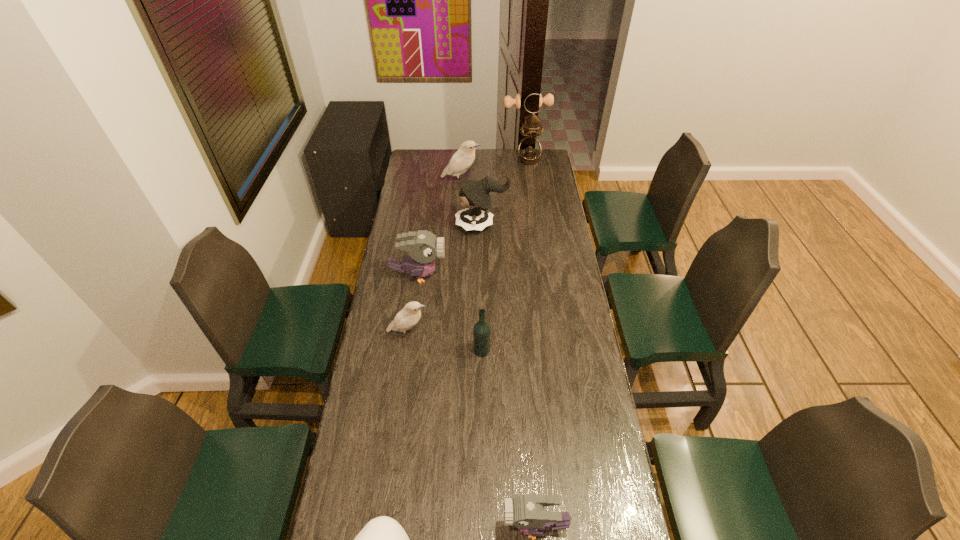
The image size is (960, 540). I want to click on oil lamp, so 529,150.

Where is `the farthest object`? This screenshot has width=960, height=540. the farthest object is located at coordinates (529, 150).

Find the location of `doll`. doll is located at coordinates (476, 200).

At what (x,y) coordinates should I click in order to perform the action: click on the second farthest object. Please return your answer as a coordinate pair (x, y). Looking at the image, I should click on (460, 162).

What are the coordinates of `the bigger white bird` in the screenshot? It's located at (460, 162).

Where is `black vodka`? This screenshot has width=960, height=540. black vodka is located at coordinates (481, 331).

The height and width of the screenshot is (540, 960). I want to click on the third nearest object, so click(x=481, y=331).

What are the coordinates of `the fourth farthest object` in the screenshot? It's located at (423, 246).

I want to click on the second farthest bird, so click(x=423, y=246).

Locate an element on the screen. The image size is (960, 540). the second nearest bird is located at coordinates (405, 319).